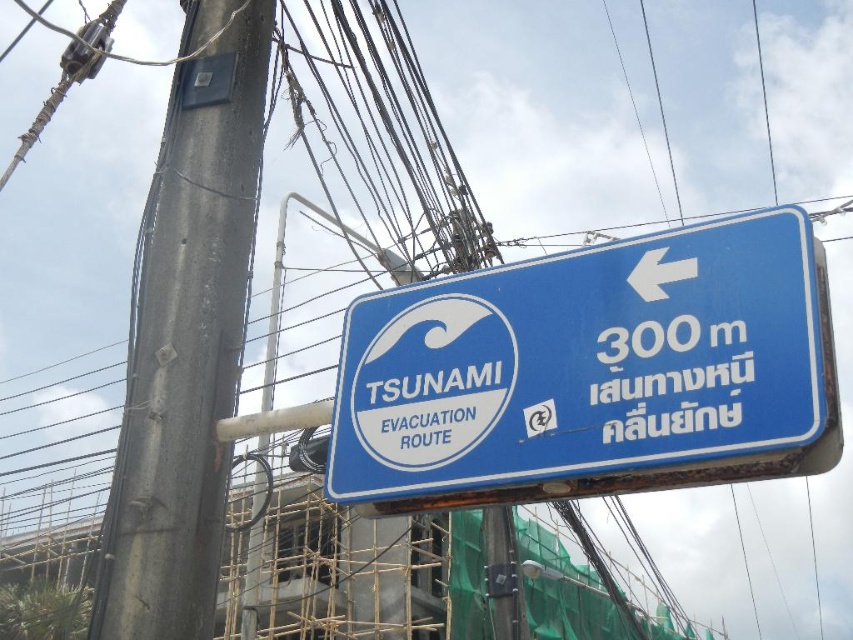
You are standing in front of the blue plastic sign at upper center and the gray concrete pole at left. Which object is closer to you?

The blue plastic sign at upper center is closer to you because it is in front of the gray concrete pole at left.

You are standing in front of the tsunami evacuation route sign and want to locate two points marked on it. Which of the two points, point (448, 444) or point (142, 545), appears closer to you?

Point (448, 444) is closer to the camera than point (142, 545), so it appears closer to you.

You are a city planner checking the placement of the blue plastic sign at upper center and the gray concrete pole at left. According to safety regulations, these two objects must be at least 3 meters apart to avoid visual obstruction. Does the current spacing meet the requirement?

The blue plastic sign at upper center and gray concrete pole at left are 2.75 meters apart, which is less than the required 3 meters. Therefore, the current spacing does not meet the safety regulation requirement.